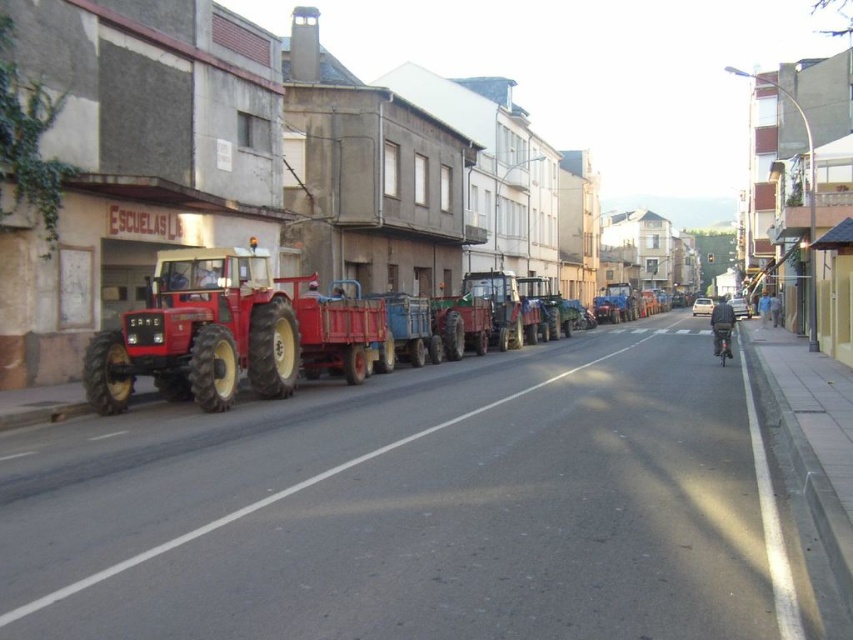
You are a delivery driver who needs to park your truck between the matte red tractor at left and the metallic red tractor at center. The truck requires 6 meters of space to park. Based on the scene, can you fit your truck between them?

The matte red tractor at left and metallic red tractor at center are 5.76 meters apart. Since the truck requires 6 meters of space, there isn not enough space to park between them.